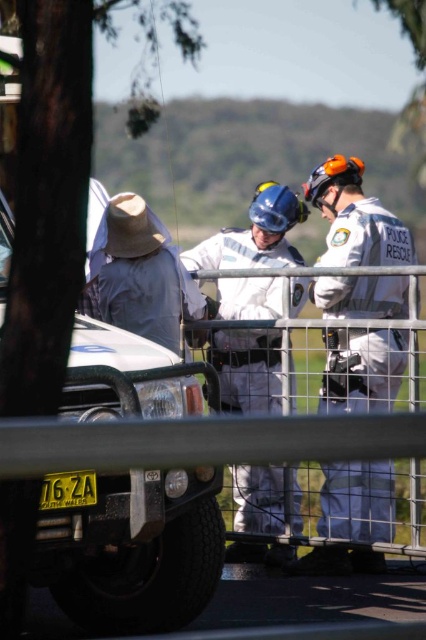
Image resolution: width=426 pixels, height=640 pixels. What do you see at coordinates (129, 547) in the screenshot? I see `matte white vehicle at left` at bounding box center [129, 547].

Find the location of a particular element. The image size is (426, 640). matte white vehicle at left is located at coordinates (129, 547).